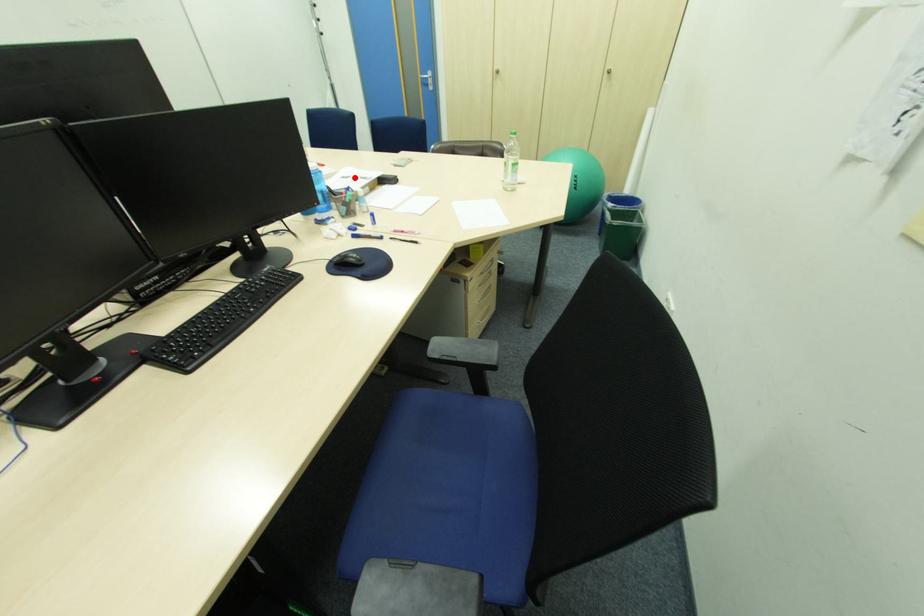
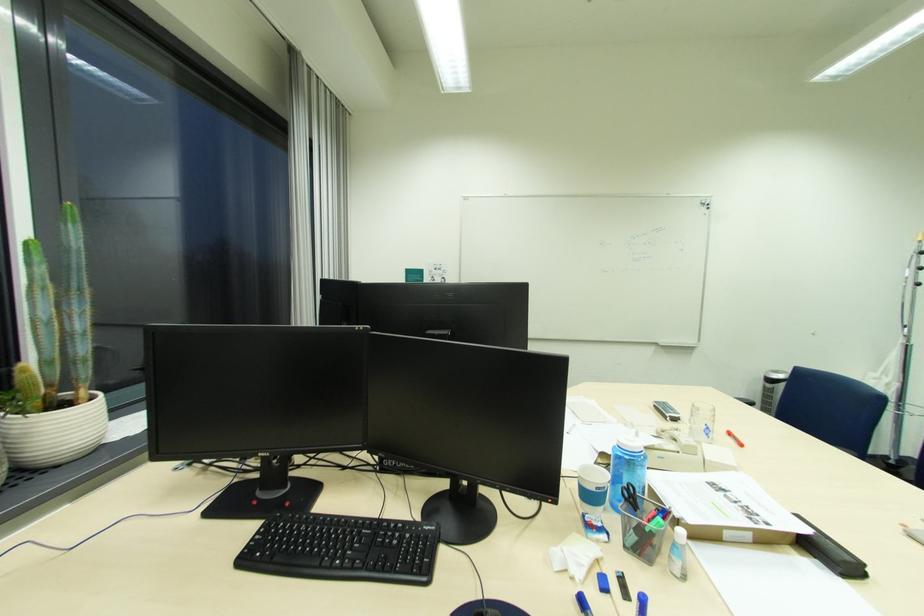
The point at the highlighted location is marked in the first image. Where is the corresponding point in the second image?

(731, 491)